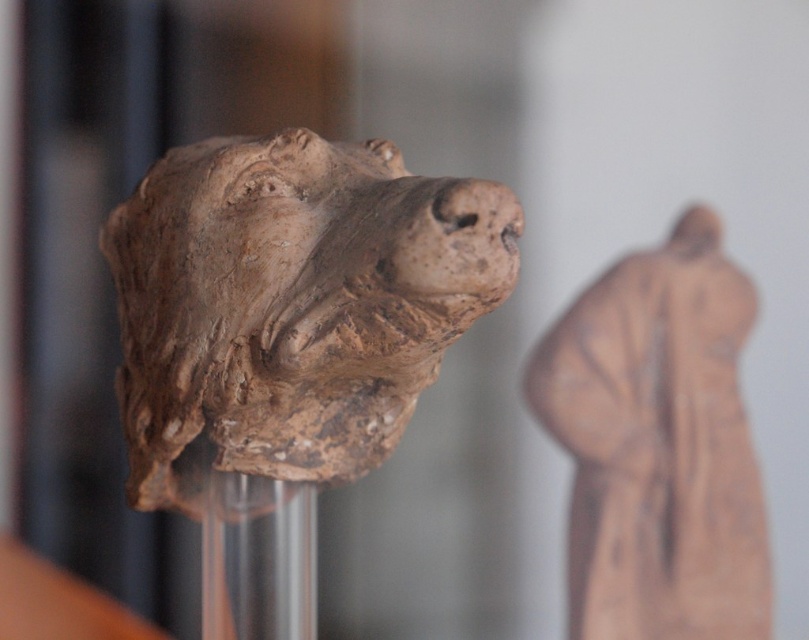
Question: Which of the following is the farthest from the observer?

Choices:
 (A) matte clay figure at center
 (B) matte clay head at center
 (C) brown clay head at center
 (D) transparent glass vase at center

Answer: (B)

Question: Is brown clay head at center above matte clay head at center?

Choices:
 (A) no
 (B) yes

Answer: (A)

Question: Is brown clay head at center thinner than matte clay figure at center?

Choices:
 (A) no
 (B) yes

Answer: (A)

Question: Which point is closer to the camera?

Choices:
 (A) (699, 252)
 (B) (456, 250)
 (C) (206, 497)
 (D) (642, 292)

Answer: (B)

Question: In this image, where is matte clay figure at center located relative to matte clay head at center?

Choices:
 (A) below
 (B) above

Answer: (A)

Question: Which point is farther to the camera?

Choices:
 (A) (259, 412)
 (B) (706, 244)

Answer: (B)